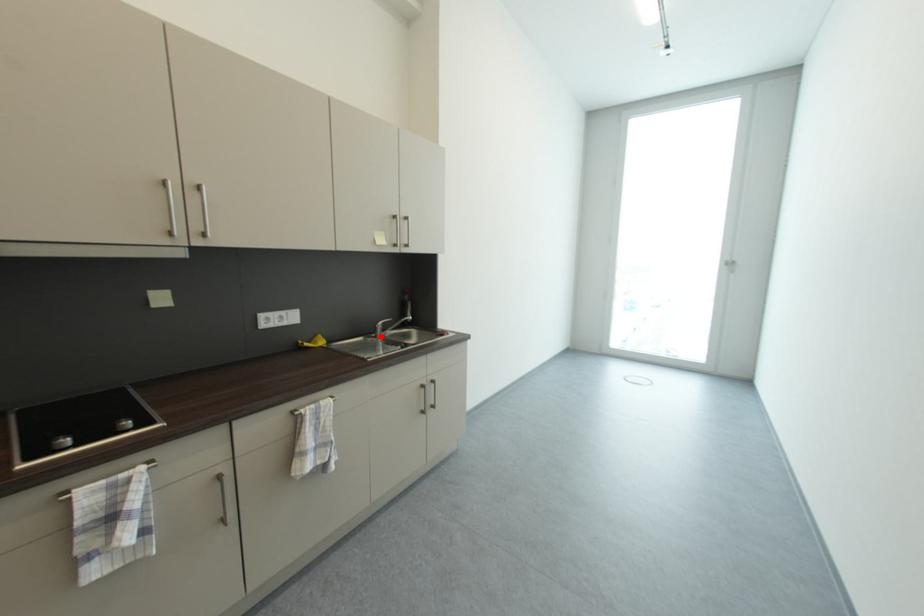
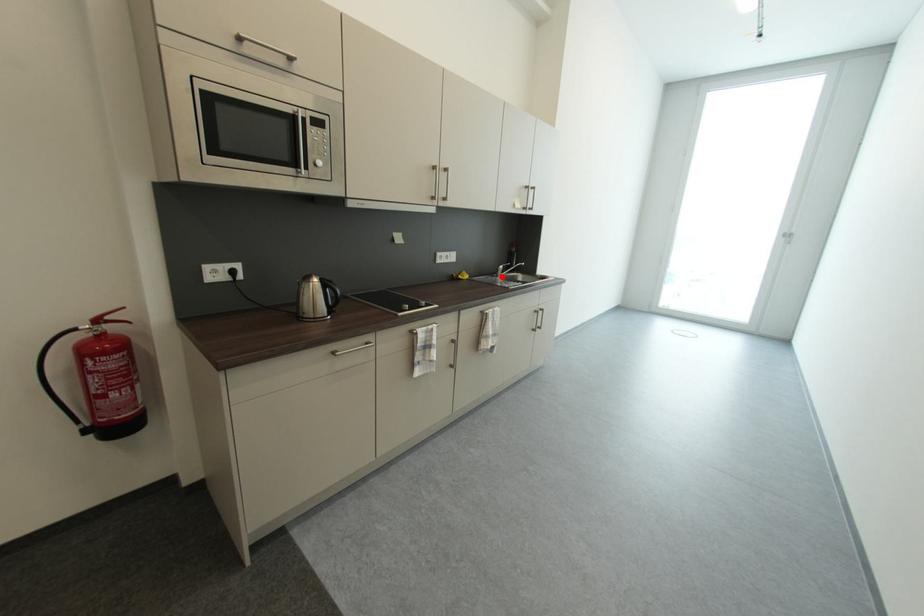
I am providing you with two images of the same scene from different viewpoints. A red point is marked on the first image and another point is marked on the second image. Does the point marked in image1 correspond to the same location as the one in image2?

Yes